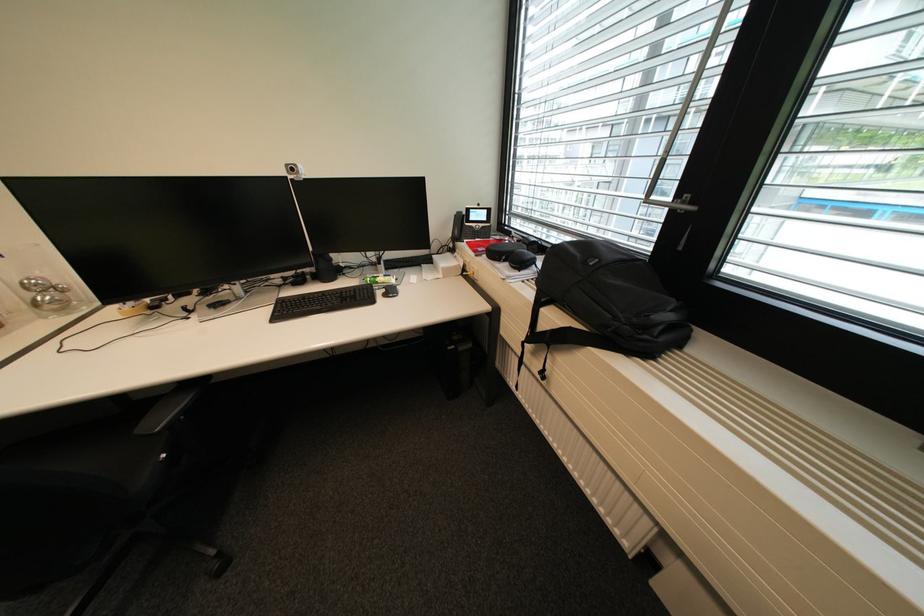
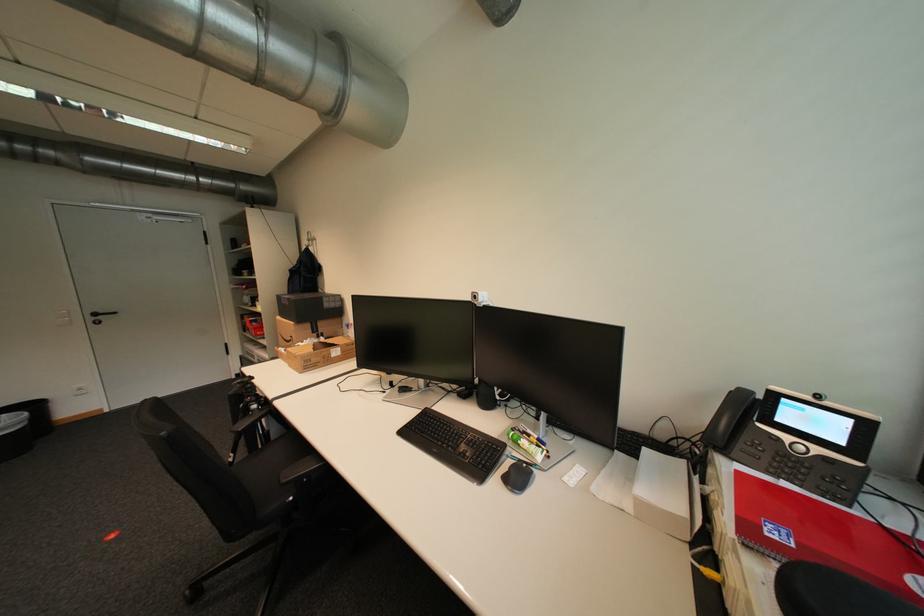
Find the pixel in the second image that matches the point at 300,169 in the first image.

(483, 297)